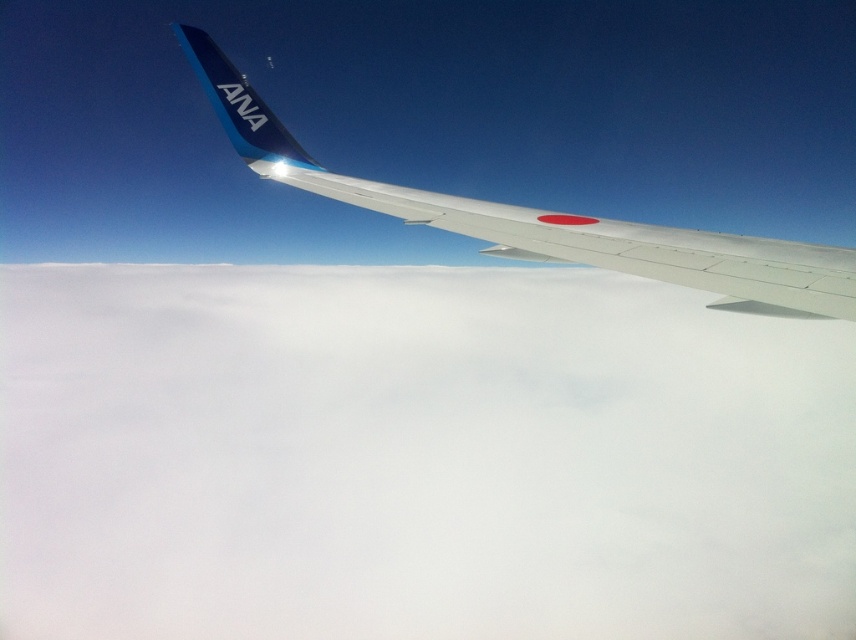
Question: Does white fluffy cloud at upper center come behind metallic silver wing at upper center?

Choices:
 (A) yes
 (B) no

Answer: (A)

Question: Is white fluffy cloud at upper center positioned in front of metallic silver wing at upper center?

Choices:
 (A) no
 (B) yes

Answer: (A)

Question: Does white fluffy cloud at upper center appear on the left side of metallic silver wing at upper center?

Choices:
 (A) no
 (B) yes

Answer: (B)

Question: Which object is farther from the camera taking this photo?

Choices:
 (A) white fluffy cloud at upper center
 (B) metallic silver wing at upper center

Answer: (A)